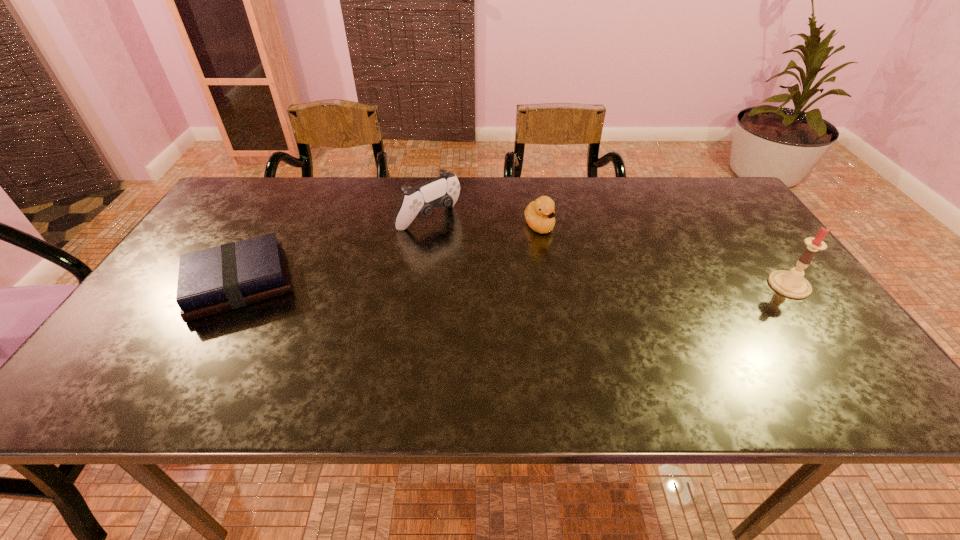
Locate an element on the screen. free space between the duckling and the leftmost object is located at coordinates (389, 255).

Image resolution: width=960 pixels, height=540 pixels. I want to click on free space between the tallest object and the third shortest object, so click(609, 252).

In order to click on free area in between the rightmost object and the third shortest object in this screenshot , I will do `click(609, 252)`.

The image size is (960, 540). Find the location of `free space between the second shortest object and the second object from left to right`. free space between the second shortest object and the second object from left to right is located at coordinates 484,223.

Where is `the closest object relative to the third object from right to left`? The width and height of the screenshot is (960, 540). the closest object relative to the third object from right to left is located at coordinates 539,214.

Choose which object is the second nearest neighbor to the leftmost object. Please provide its 2D coordinates. Your answer should be formatted as a tuple, i.e. [(x, y)], where the tuple contains the x and y coordinates of a point satisfying the conditions above.

[(539, 214)]

Where is `vacant space that satisfies the following two spatial constraints: 1. on the front side of the control; 2. on the left side of the rightmost object`? This screenshot has height=540, width=960. vacant space that satisfies the following two spatial constraints: 1. on the front side of the control; 2. on the left side of the rightmost object is located at coordinates (420, 285).